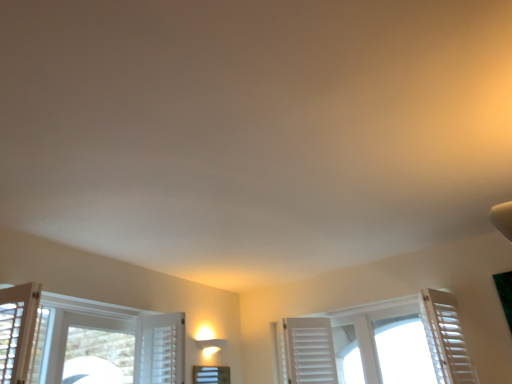
Question: Which direction should I rotate to look at white frosted glass window at center, the 2th window when ordered from right to left?

Choices:
 (A) left
 (B) right

Answer: (A)

Question: From a real-world perspective, is white frosted glass window at center, which is counted as the 1th window, starting from the left, on top of white matte shutter at right?

Choices:
 (A) yes
 (B) no

Answer: (B)

Question: Is the position of white frosted glass window at center, which is counted as the 1th window, starting from the left, more distant than that of white matte shutter at right?

Choices:
 (A) no
 (B) yes

Answer: (B)

Question: Is white frosted glass window at center, which is counted as the 1th window, starting from the left, not near white matte shutter at right?

Choices:
 (A) yes
 (B) no

Answer: (A)

Question: Is the depth of white frosted glass window at center, the 2th window when ordered from right to left, less than that of white matte shutter at right?

Choices:
 (A) yes
 (B) no

Answer: (B)

Question: Can you confirm if white frosted glass window at center, which is counted as the 1th window, starting from the left, is shorter than white matte shutter at right?

Choices:
 (A) no
 (B) yes

Answer: (B)

Question: From a real-world perspective, is white frosted glass window at center, which is counted as the 1th window, starting from the left, beneath white matte shutter at right?

Choices:
 (A) yes
 (B) no

Answer: (A)

Question: From a real-world perspective, is white matte shutter at right positioned over white wooden shutters at center, placed as the first window when sorted from right to left, based on gravity?

Choices:
 (A) no
 (B) yes

Answer: (A)

Question: From a real-world perspective, is white matte shutter at right under white wooden shutters at center, placed as the first window when sorted from right to left?

Choices:
 (A) no
 (B) yes

Answer: (B)

Question: Is there a large distance between white matte shutter at right and white wooden shutters at center, placed as the 2th window when sorted from left to right?

Choices:
 (A) no
 (B) yes

Answer: (A)

Question: Is white matte shutter at right not within white wooden shutters at center, placed as the first window when sorted from right to left?

Choices:
 (A) no
 (B) yes

Answer: (B)

Question: Considering the relative sizes of white matte shutter at right and white wooden shutters at center, placed as the 2th window when sorted from left to right, in the image provided, is white matte shutter at right taller than white wooden shutters at center, placed as the 2th window when sorted from left to right,?

Choices:
 (A) yes
 (B) no

Answer: (B)

Question: Is white matte shutter at right wider than white wooden shutters at center, placed as the first window when sorted from right to left?

Choices:
 (A) yes
 (B) no

Answer: (B)

Question: Considering the relative sizes of white frosted glass window at center, which is counted as the 1th window, starting from the left, and white wooden shutters at center, placed as the 2th window when sorted from left to right, in the image provided, is white frosted glass window at center, which is counted as the 1th window, starting from the left, thinner than white wooden shutters at center, placed as the 2th window when sorted from left to right,?

Choices:
 (A) yes
 (B) no

Answer: (A)